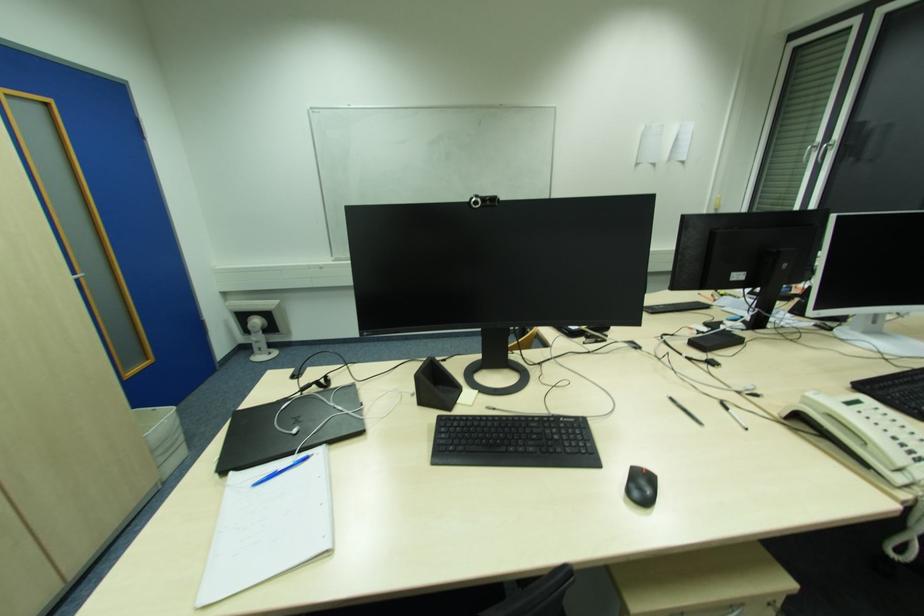
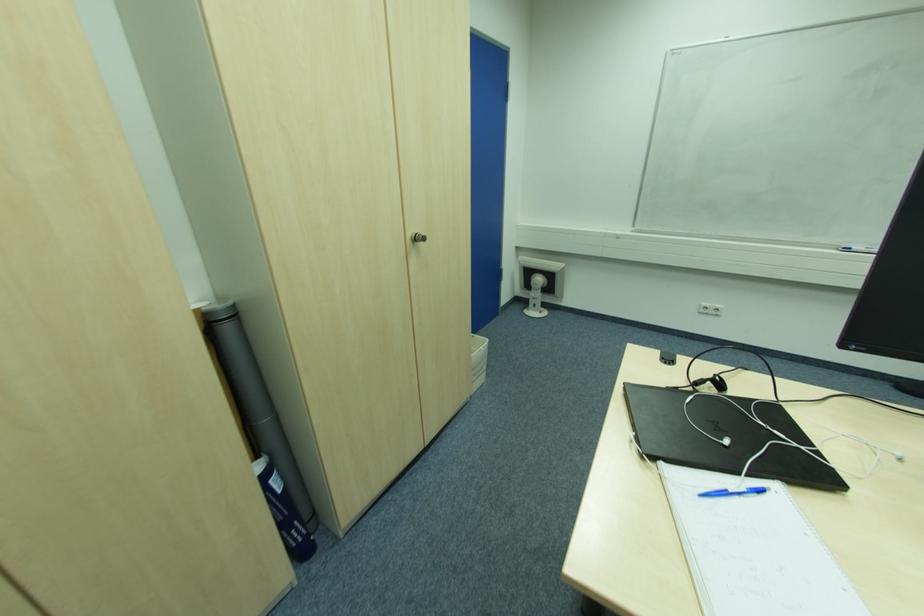
Locate, in the second image, the point that corresponds to pixel 296 431 in the first image.

(728, 443)